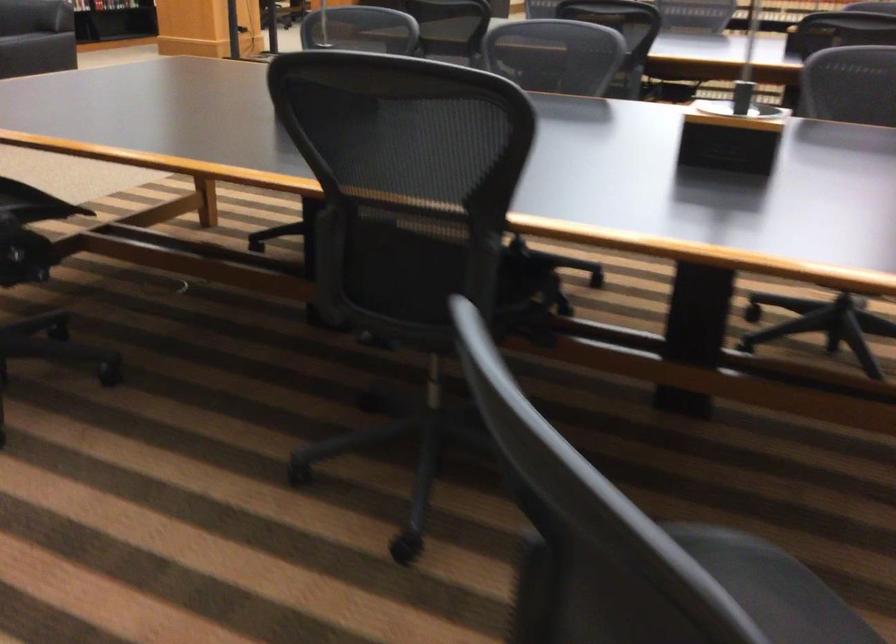
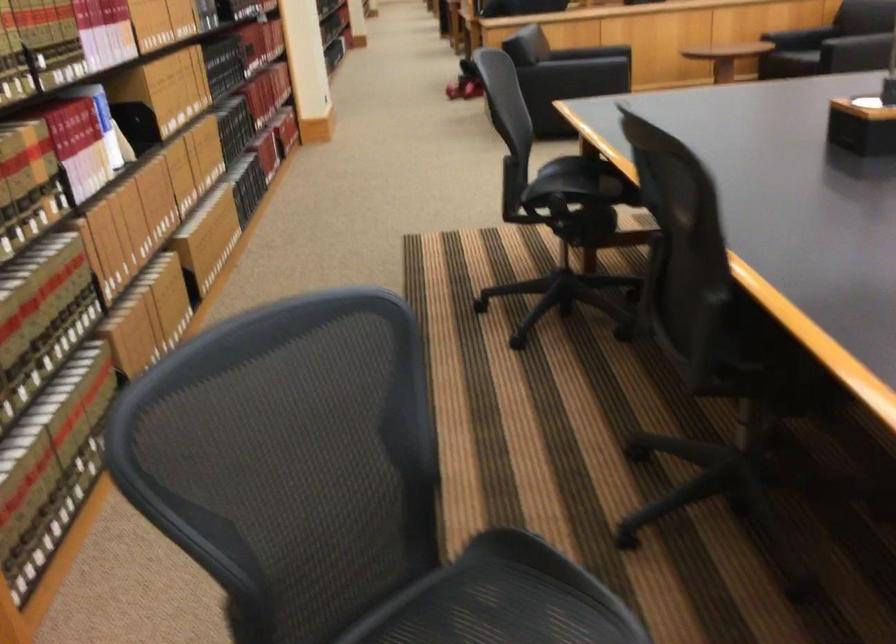
Question: I am providing you with two images of the same scene from different viewpoints. Please identify which objects are invisible in image2.

Choices:
 (A) brown library binder
 (B) black chair armrest
 (C) yellow-lidded jar
 (D) black square box

Answer: (B)